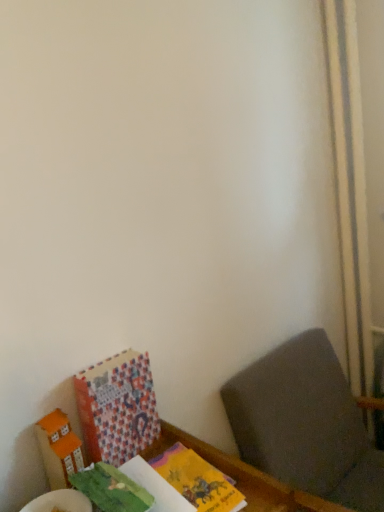
Question: Do you think dark gray fabric at lower right is within wooden table at lower left, or outside of it?

Choices:
 (A) inside
 (B) outside

Answer: (B)

Question: In the image, is dark gray fabric at lower right positioned in front of or behind wooden table at lower left?

Choices:
 (A) front
 (B) behind

Answer: (B)

Question: Which object is the closest to the wooden table at lower left?

Choices:
 (A) dark gray fabric at lower right
 (B) patterned paper book at lower left
 (C) orange matte cardboard box at lower left

Answer: (B)

Question: Based on their relative distances, which object is nearer to the wooden table at lower left?

Choices:
 (A) dark gray fabric at lower right
 (B) patterned paper book at lower left
 (C) orange matte cardboard box at lower left

Answer: (B)